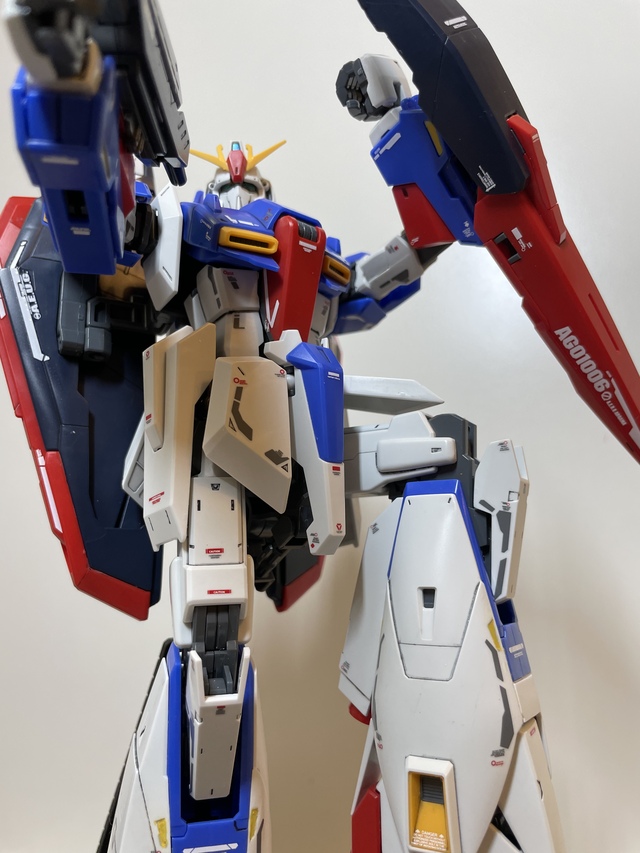
This screenshot has height=853, width=640. What are the coordinates of `action figure` in the screenshot? It's located at click(232, 218).